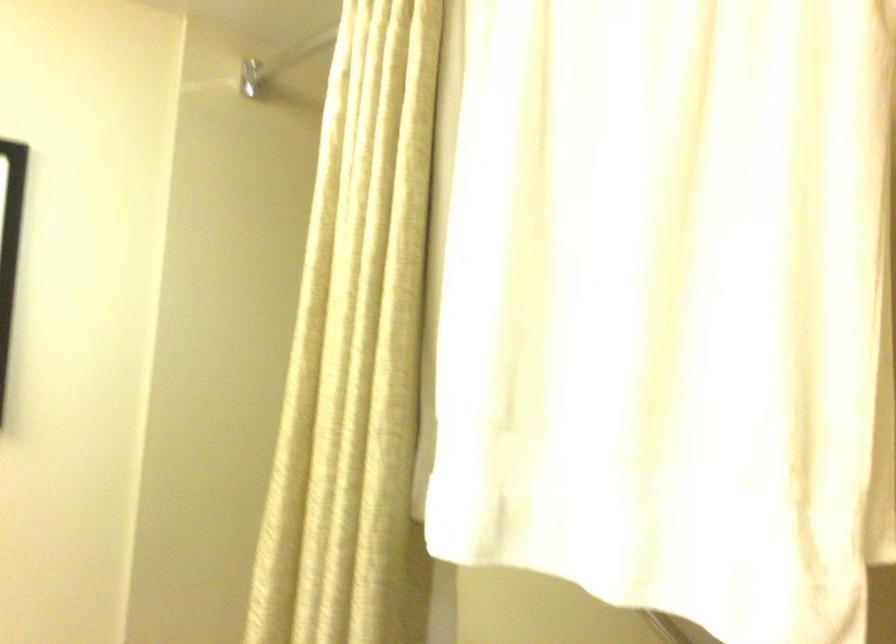
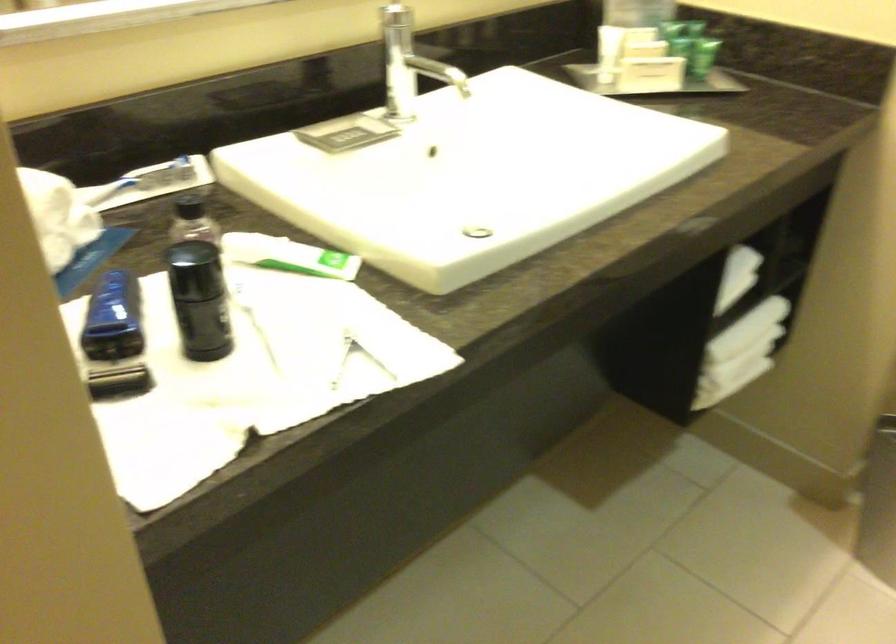
The images are taken continuously from a first-person perspective. In which direction is your viewpoint rotating?

The camera rotated toward left-down.